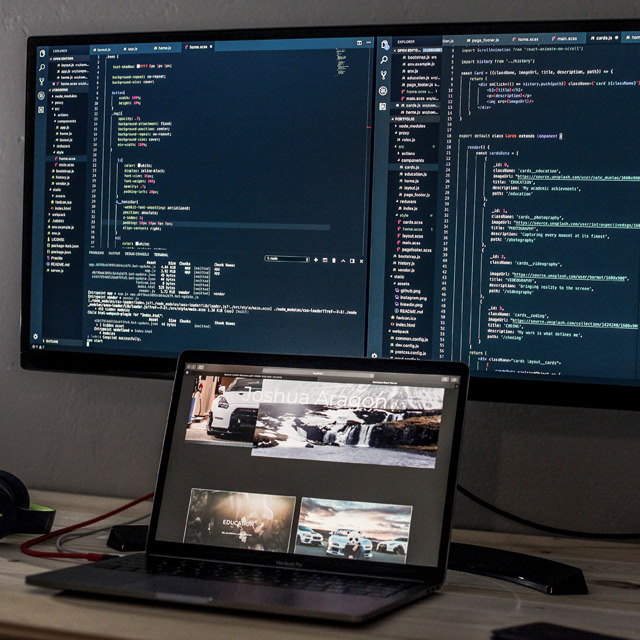
The width and height of the screenshot is (640, 640). Identify the location of wall. (121, 441).